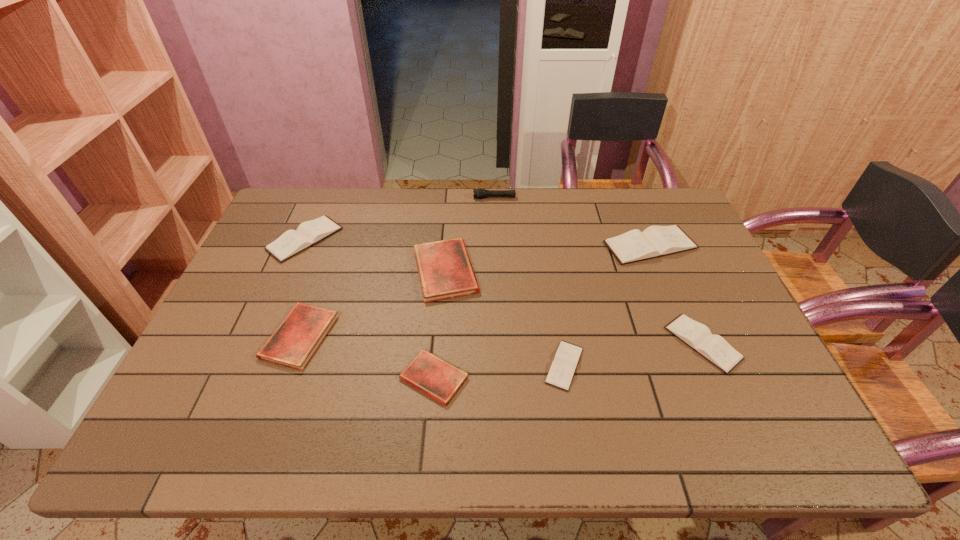
Identify the location of the fifth closest diary to the third biggest brown diary. This screenshot has height=540, width=960. (294, 342).

Identify which diary is the second nearest to the biggest brown diary. Please provide its 2D coordinates. Your answer should be formatted as a tuple, i.e. [(x, y)], where the tuple contains the x and y coordinates of a point satisfying the conditions above.

[(563, 367)]

Find the location of a particular element. The height and width of the screenshot is (540, 960). brown diary object that ranks as the third closest to the smallest brown diary is located at coordinates 292,242.

Identify which brown diary is located as the third nearest to the second smallest brown diary. Please provide its 2D coordinates. Your answer should be formatted as a tuple, i.e. [(x, y)], where the tuple contains the x and y coordinates of a point satisfying the conditions above.

[(292, 242)]

Find the location of `red diary that stands as the third closest to the leftmost brown diary`. red diary that stands as the third closest to the leftmost brown diary is located at coordinates (430, 374).

The height and width of the screenshot is (540, 960). Identify the location of red diary that can be found as the third closest to the farthest object. (430, 374).

This screenshot has height=540, width=960. I want to click on free space that satisfies the following two spatial constraints: 1. on the back side of the farthest red diary; 2. on the right side of the biggest brown diary, so click(447, 246).

This screenshot has width=960, height=540. Find the location of `vacant position in the image that satisfies the following two spatial constraints: 1. on the back side of the biggest brown diary; 2. at the lens end of the farthest object`. vacant position in the image that satisfies the following two spatial constraints: 1. on the back side of the biggest brown diary; 2. at the lens end of the farthest object is located at coordinates [630, 198].

Where is `free space that satisfies the following two spatial constraints: 1. on the front side of the tallest diary; 2. on the right side of the third biggest brown diary`? The height and width of the screenshot is (540, 960). free space that satisfies the following two spatial constraints: 1. on the front side of the tallest diary; 2. on the right side of the third biggest brown diary is located at coordinates (690, 343).

You are a GUI agent. You are given a task and a screenshot of the screen. Output one action in this format:
    pyautogui.click(x=<x>, y=<y>)
    Task: Click on the vacant point that satisfies the following two spatial constraints: 1. at the lens end of the farthest object; 2. on the front side of the smallest red diary
    The image size is (960, 540).
    Given the screenshot: What is the action you would take?
    pyautogui.click(x=501, y=378)